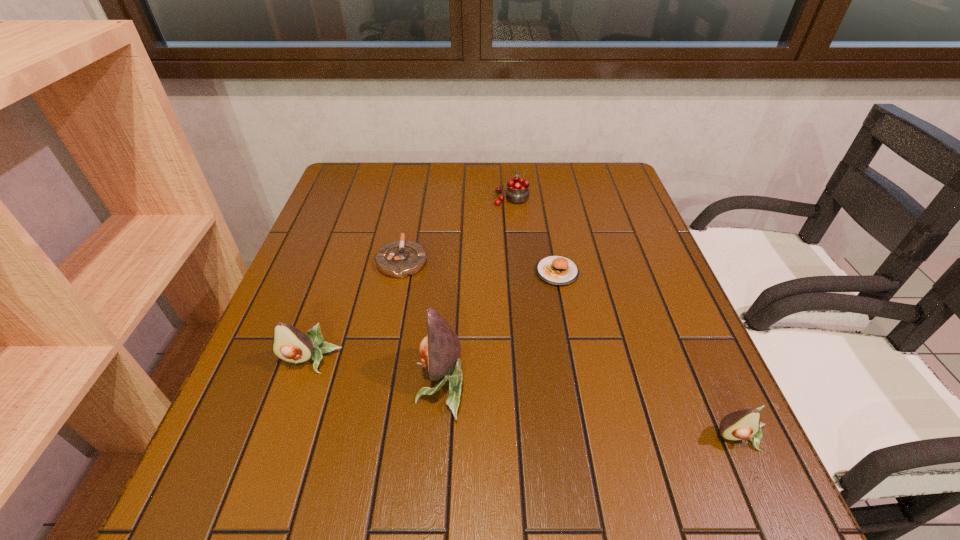
Where is `free space between the ashtray and the rightmost object`? free space between the ashtray and the rightmost object is located at coordinates pyautogui.click(x=571, y=349).

Where is `vacant space that's between the farthest object and the fifth object from right to left`? The width and height of the screenshot is (960, 540). vacant space that's between the farthest object and the fifth object from right to left is located at coordinates (457, 228).

Image resolution: width=960 pixels, height=540 pixels. Find the location of `vacant area that lies between the ashtray and the second tallest avocado`. vacant area that lies between the ashtray and the second tallest avocado is located at coordinates (356, 310).

At what (x,y) coordinates should I click in order to perform the action: click on free space between the rightmost avocado and the food. Please return your answer as a coordinate pair (x, y). Looking at the image, I should click on (649, 355).

Locate an element on the screen. The width and height of the screenshot is (960, 540). unoccupied area between the farthest object and the rightmost avocado is located at coordinates (626, 318).

Where is `free space between the farthest object and the tallest object`? Image resolution: width=960 pixels, height=540 pixels. free space between the farthest object and the tallest object is located at coordinates (476, 291).

The width and height of the screenshot is (960, 540). Find the location of `free space between the fifth shortest object and the tallest avocado`. free space between the fifth shortest object and the tallest avocado is located at coordinates (375, 373).

Image resolution: width=960 pixels, height=540 pixels. I want to click on vacant area between the rightmost object and the second tallest avocado, so click(525, 399).

At what (x,y) coordinates should I click in order to perform the action: click on object identified as the second closest to the cherry. Please return your answer as a coordinate pair (x, y). The width and height of the screenshot is (960, 540). Looking at the image, I should click on (399, 259).

Identify the location of object that is the fifth closest to the leftmost avocado. The image size is (960, 540). (745, 424).